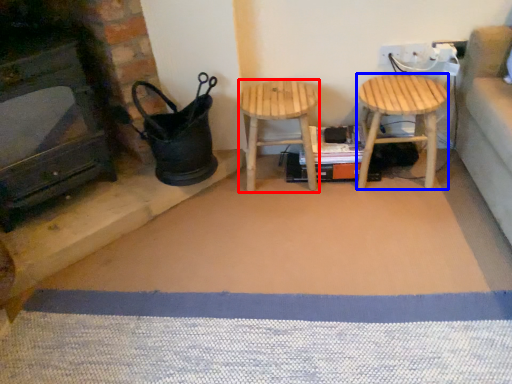
Question: Which point is closer to the camera, stool (highlighted by a red box) or stool (highlighted by a blue box)?

Choices:
 (A) stool
 (B) stool

Answer: (B)